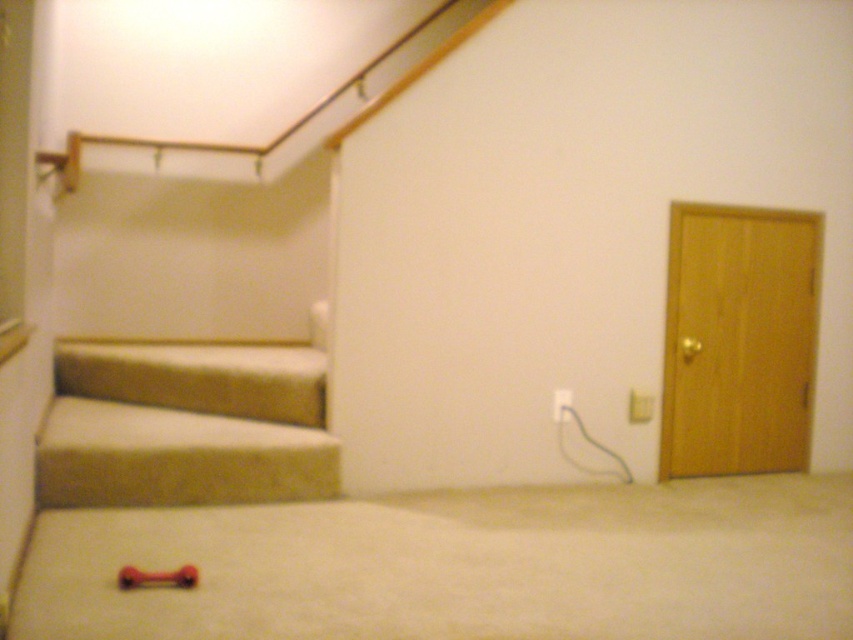
Looking at this image, which is more to the right, white plastic electric outlet at lower right or white plastic electric outlet at center-right?

white plastic electric outlet at lower right is more to the right.

Between point (645, 403) and point (572, 400), which one is positioned in front?

Point (572, 400)

Who is more forward, (636,397) or (564,413)?

Point (564,413)

You are a GUI agent. You are given a task and a screenshot of the screen. Output one action in this format:
    pyautogui.click(x=<x>, y=<y>)
    Task: Click on the white plastic electric outlet at lower right
    
    Given the screenshot: What is the action you would take?
    pyautogui.click(x=640, y=406)

Looking at this image, which is above, beige carpeted stairs at lower left or white plastic electric outlet at lower right?

white plastic electric outlet at lower right

How much distance is there between beige carpeted stairs at lower left and white plastic electric outlet at lower right?

The distance of beige carpeted stairs at lower left from white plastic electric outlet at lower right is 2.35 meters.

What do you see at coordinates (184, 426) in the screenshot?
I see `beige carpeted stairs at lower left` at bounding box center [184, 426].

I want to click on beige carpeted stairs at lower left, so click(x=184, y=426).

Between beige carpeted stairs at lower left and white plastic electric outlet at center-right, which one has less height?

With less height is white plastic electric outlet at center-right.

Does beige carpeted stairs at lower left have a greater height compared to white plastic electric outlet at center-right?

Indeed, beige carpeted stairs at lower left has a greater height compared to white plastic electric outlet at center-right.

Who is more distant from viewer, (x=236, y=397) or (x=556, y=416)?

The point (x=556, y=416) is behind.

In order to click on beige carpeted stairs at lower left in this screenshot , I will do `click(184, 426)`.